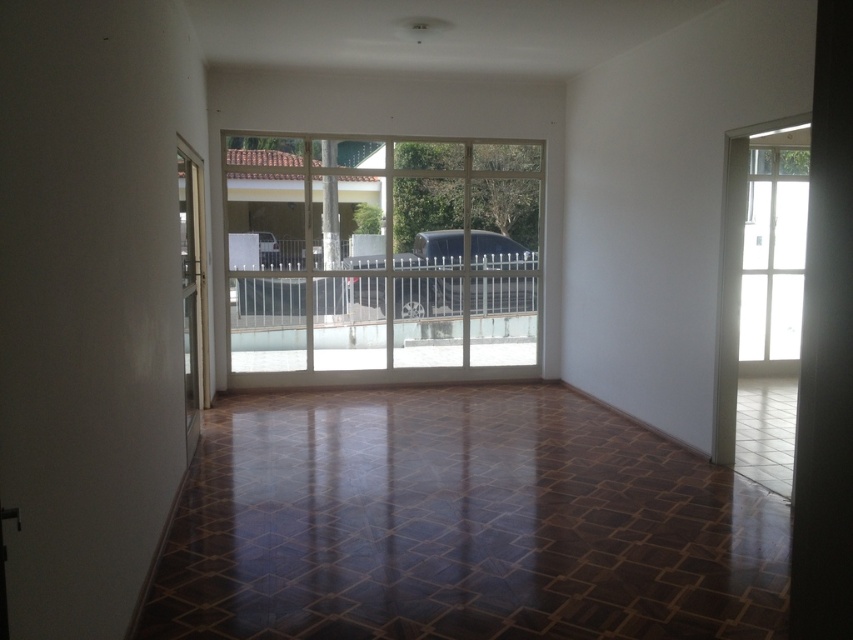
Does white metal rail at center have a larger size compared to white glass door at left?

Incorrect, white metal rail at center is not larger than white glass door at left.

Can you confirm if white metal rail at center is positioned to the right of white glass door at left?

Correct, you'll find white metal rail at center to the right of white glass door at left.

Is point (294, 291) closer to camera compared to point (184, 410)?

No, it is behind (184, 410).

At what (x,y) coordinates should I click in order to perform the action: click on white metal rail at center. Please return your answer as a coordinate pair (x, y). Image resolution: width=853 pixels, height=640 pixels. Looking at the image, I should click on (426, 296).

From the picture: Can you confirm if clear glass terrace at center is wider than white metal rail at center?

Correct, the width of clear glass terrace at center exceeds that of white metal rail at center.

Can you confirm if clear glass terrace at center is bigger than white metal rail at center?

Yes, clear glass terrace at center is bigger than white metal rail at center.

Between point (387, 170) and point (283, 296), which one is positioned behind?

The point (387, 170) is behind.

Locate an element on the screen. The height and width of the screenshot is (640, 853). clear glass terrace at center is located at coordinates (381, 253).

Is transparent glass door at right behind white glass door at left?

Yes.

Is transparent glass door at right to the right of white glass door at left from the viewer's perspective?

Correct, you'll find transparent glass door at right to the right of white glass door at left.

Locate an element on the screen. This screenshot has width=853, height=640. transparent glass door at right is located at coordinates (761, 301).